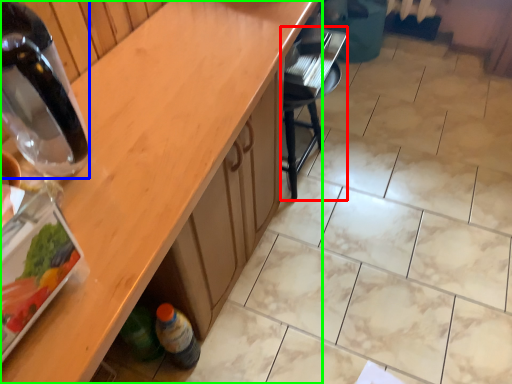
Question: Estimate the real-world distances between objects in this image. Which object is closer to chair (highlighted by a red box), bottle (highlighted by a blue box) or countertop (highlighted by a green box)?

Choices:
 (A) bottle
 (B) countertop

Answer: (B)